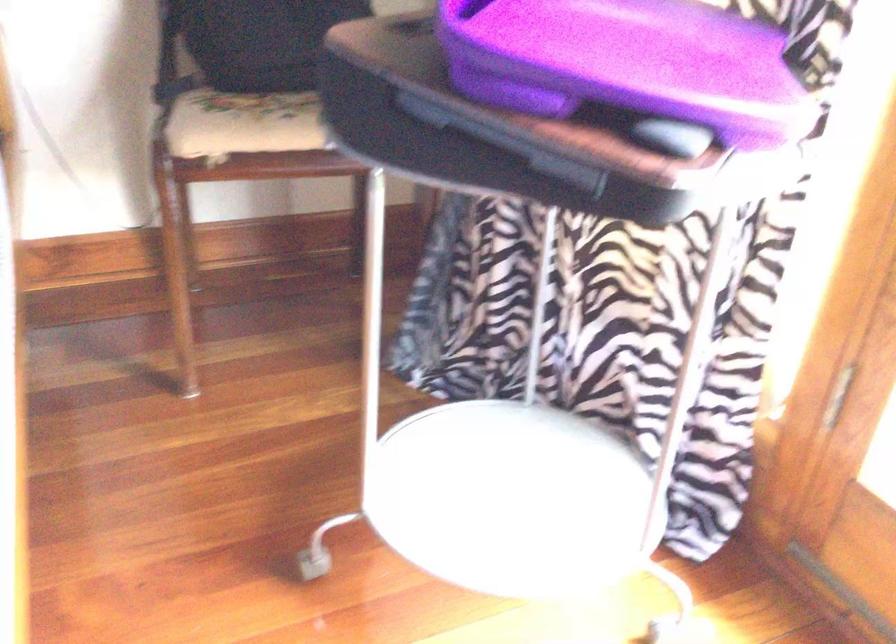
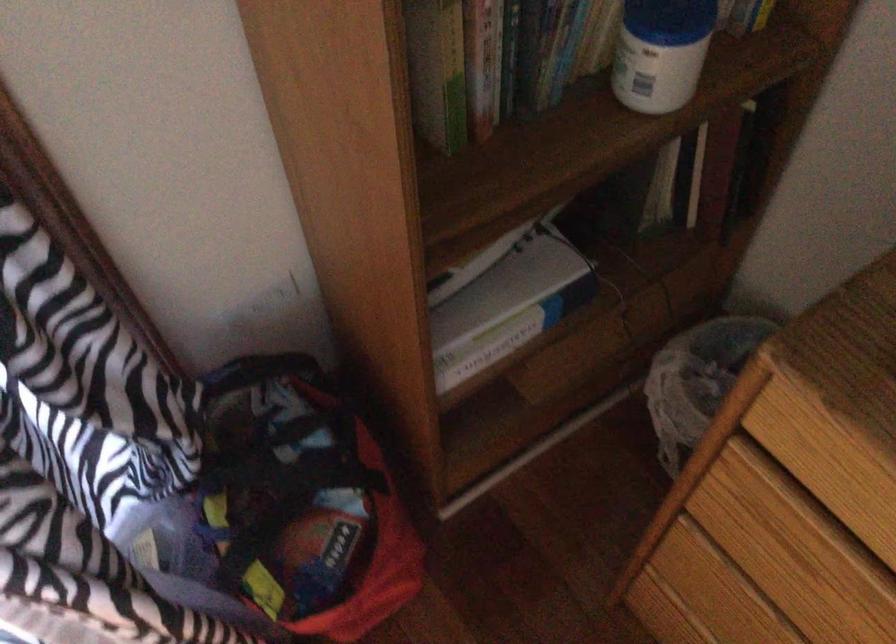
The images are taken continuously from a first-person perspective. In which direction is your viewpoint rotating?

The camera rotated toward right-down.